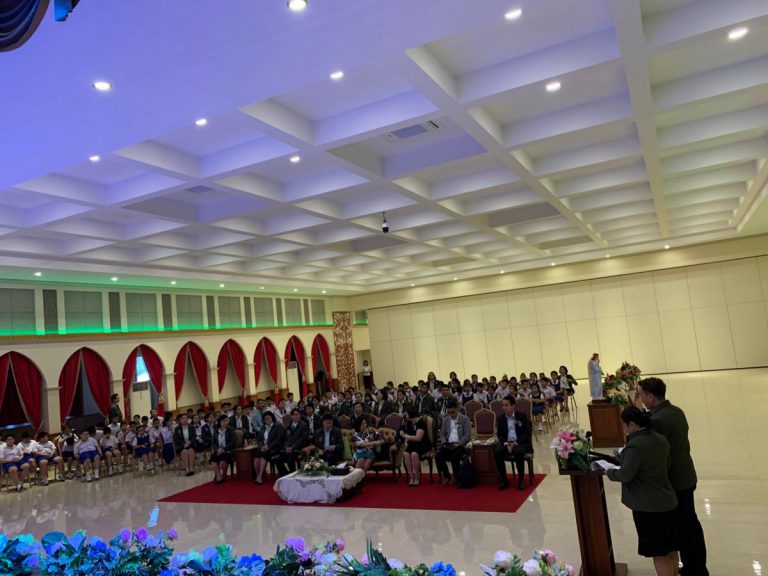
The image size is (768, 576). Find the location of `lights`. lights is located at coordinates (339, 81), (518, 12), (557, 90).